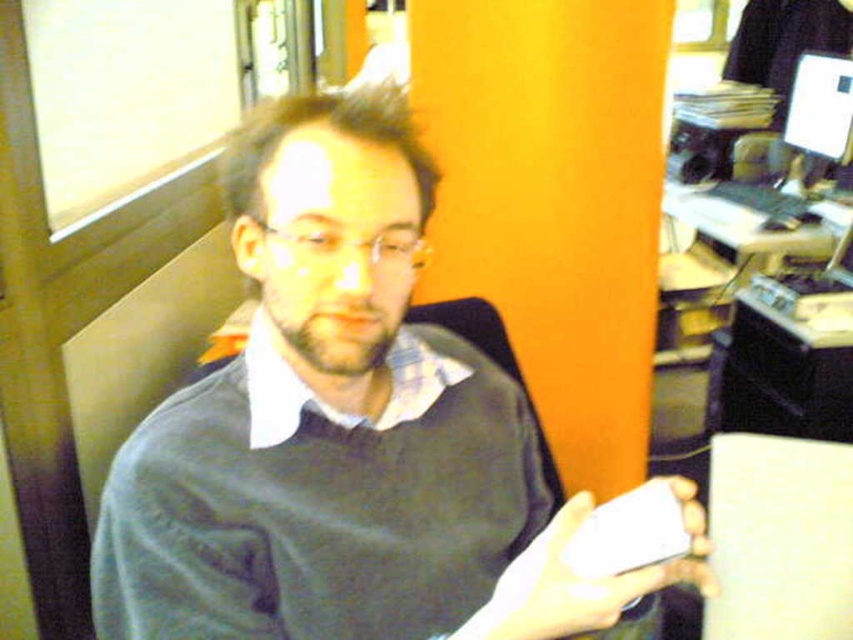
You are a tailor who needs to place both the matte gray sweater at center and the white matte phone at center into a storage box. The box has a maximum capacity of 15 liters. If the sweater takes up 12 liters and the phone takes up 3 liters, will both items fit inside the box?

The matte gray sweater at center takes up 12 liters and the white matte phone at center takes up 3 liters. Combined, they occupy 15 liters, which exactly matches the box capacity. Therefore, both items will fit inside the box.

You are a tailor trying to determine if the matte gray sweater at center can fit into a storage box designed for the white matte phone at center. Can the sweater fit into the box based on their widths?

The matte gray sweater at center might be wider than the white matte phone at center, so it may not fit into the box designed for the phone.